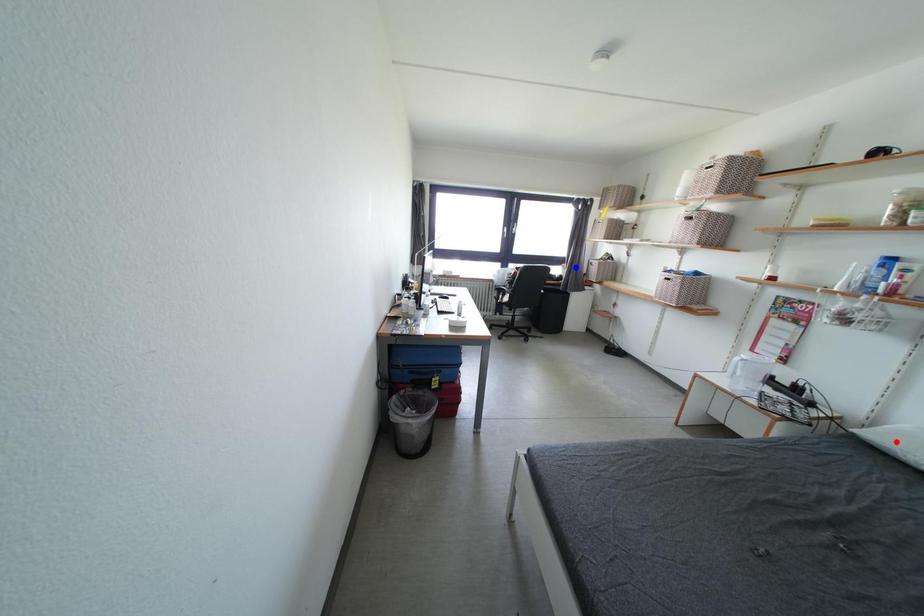
Question: Two points are marked on the image. Which point is closer to the camera?

Choices:
 (A) Blue point is closer.
 (B) Red point is closer.

Answer: (B)